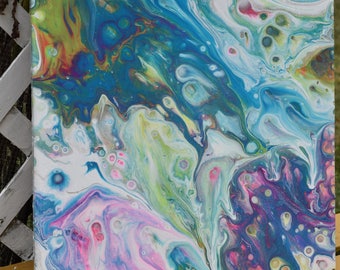
This screenshot has width=340, height=270. I want to click on pink paint, so click(115, 240).